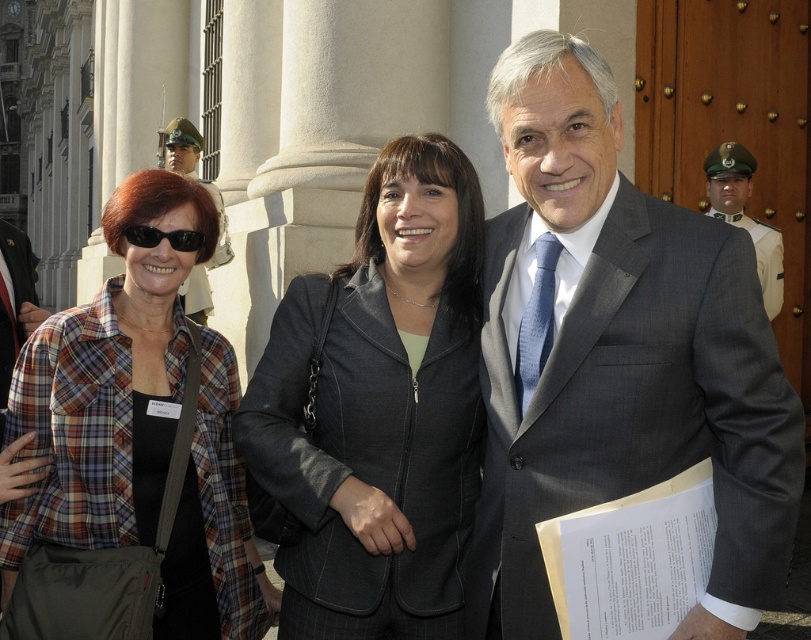
You are a photographer preparing to take a group photo of the dark gray suit at center and the plaid fabric shirt at left. Based on their sizes, which one should you position closer to the camera to ensure both appear equally sized in the photo?

The dark gray suit at center is smaller in size compared to the plaid fabric shirt at left. To make them appear the same size in the photo, position the dark gray suit at center closer to the camera than the plaid fabric shirt at left.

You are a photographer trying to capture a group photo of the three individuals in front of the grand building. You notice the plaid shirt at left and the black plastic sunglasses at upper left. Which object is located more to the left side?

The plaid shirt at left is more to the left side than the black plastic sunglasses at upper left.

You are a photographer setting up for a group photo. You need to ensure that all three subjects fit within the camera frame. Given that the dark gray suit at center and the plaid fabric shirt at left are the two widest subjects, will the third person on the right, who is narrower than both, affect the framing? Explain.

The dark gray suit at center is wider than the plaid fabric shirt at left. Since the third person is narrower than both, the framing only needs to accommodate the width of the dark gray suit at center and the plaid fabric shirt at left. Therefore, the third person on the right will not affect the framing as they are narrower and will fit within the existing frame.